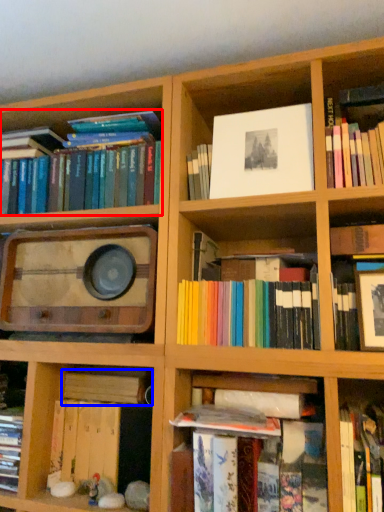
Question: Which object appears closest to the camera in this image, book (highlighted by a red box) or book (highlighted by a blue box)?

Choices:
 (A) book
 (B) book

Answer: (B)